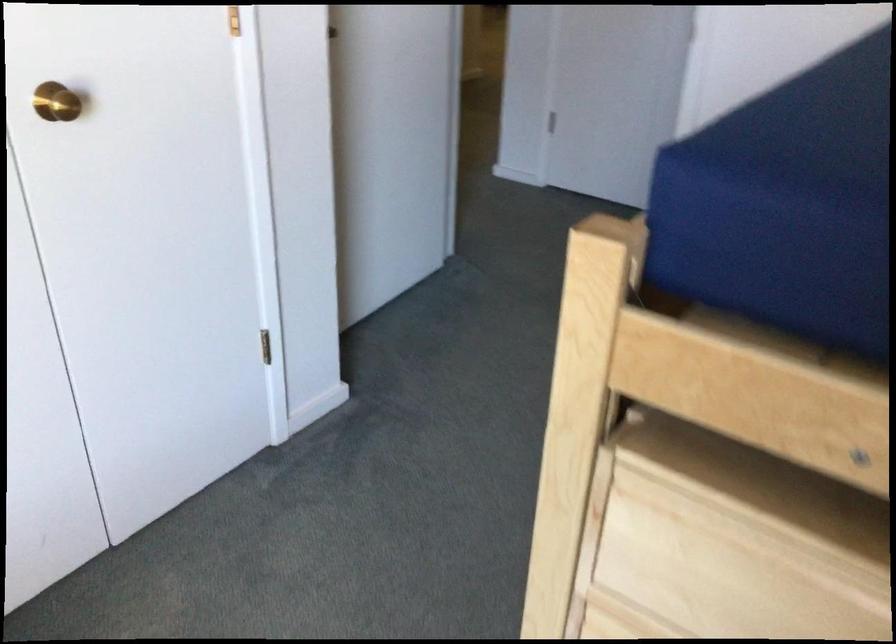
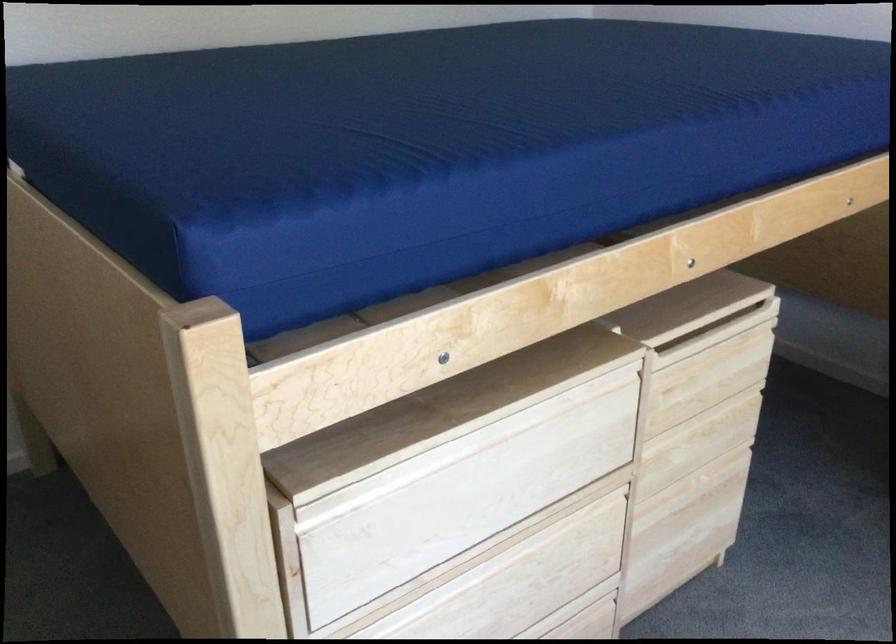
Based on the continuous images, in which direction is the camera rotating?

The camera rotated toward right-down.